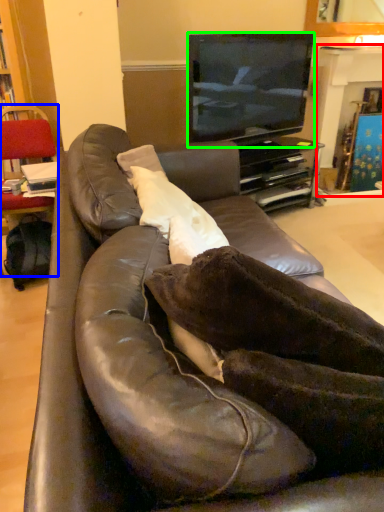
Question: Which object is the farthest from fireplace (highlighted by a red box)? Choose among these: chair (highlighted by a blue box) or television (highlighted by a green box).

Choices:
 (A) chair
 (B) television

Answer: (A)